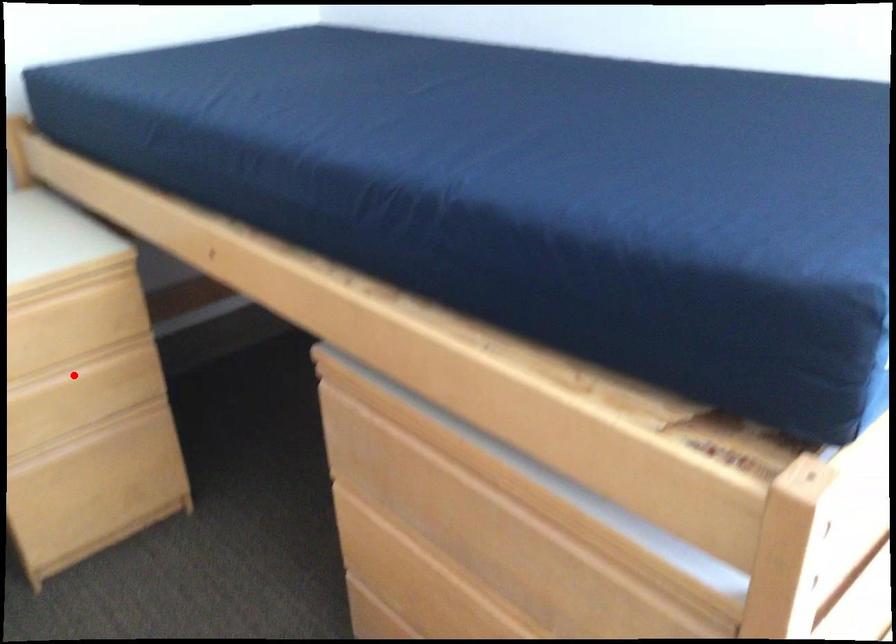
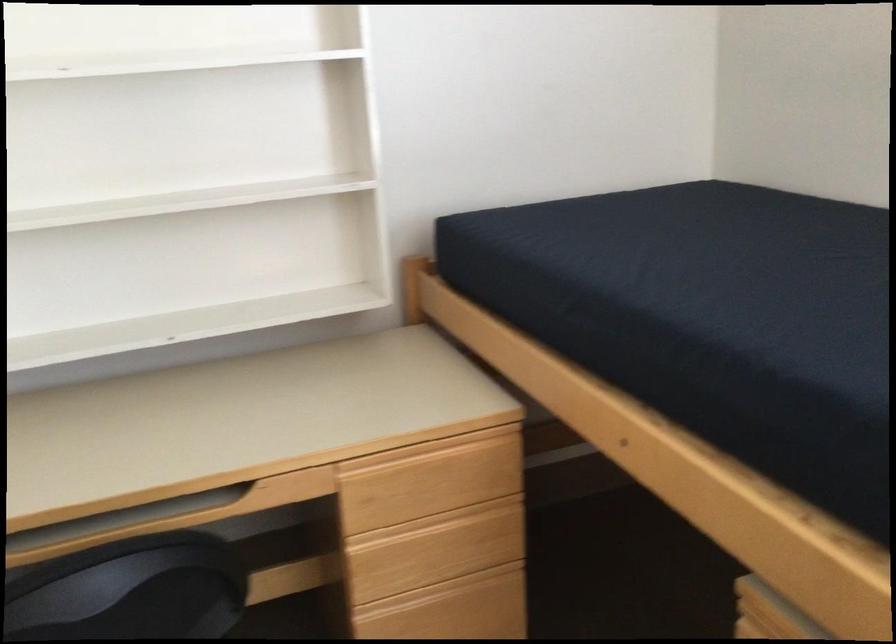
Where in the second image is the point corresponding to the highlighted location from the first image?

(443, 524)